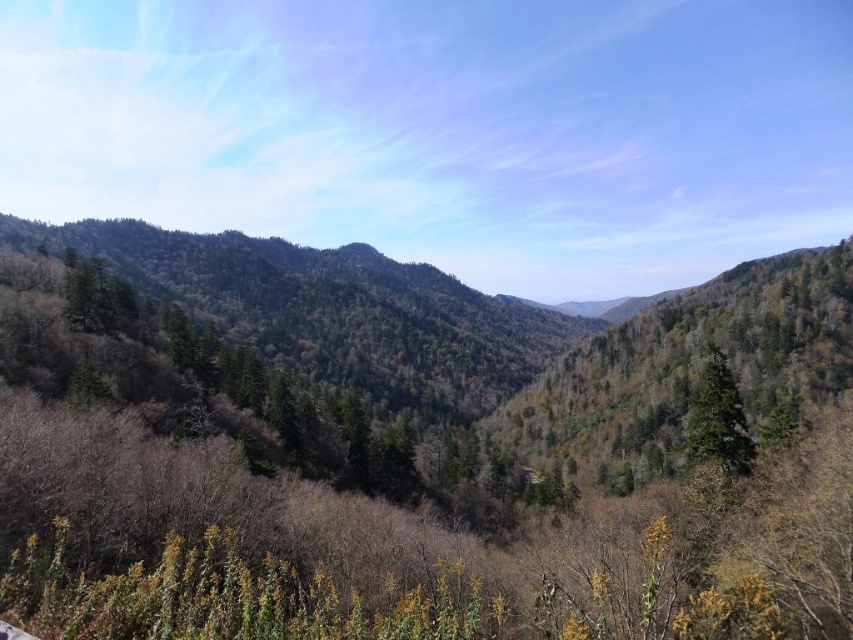
Question: Observing the image, what is the correct spatial positioning of green textured forest at center in reference to green matte tree at center-right?

Choices:
 (A) below
 (B) above

Answer: (B)

Question: Which point is closer to the camera?

Choices:
 (A) (753, 378)
 (B) (711, 451)

Answer: (B)

Question: From the image, what is the correct spatial relationship of green textured forest at center in relation to green matte tree at center-right?

Choices:
 (A) above
 (B) below

Answer: (A)

Question: Which point appears farthest from the camera in this image?

Choices:
 (A) (287, 285)
 (B) (699, 429)

Answer: (A)

Question: Which point appears farthest from the camera in this image?

Choices:
 (A) (830, 269)
 (B) (718, 412)

Answer: (A)

Question: Is the position of green textured forest at center more distant than that of green matte tree at center-right?

Choices:
 (A) yes
 (B) no

Answer: (A)